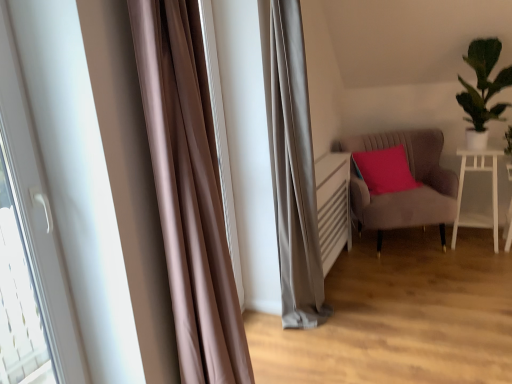
This screenshot has width=512, height=384. Find the location of `vacant region under satin brown curtain at left (from a real-world perspective)`. vacant region under satin brown curtain at left (from a real-world perspective) is located at coordinates (266, 339).